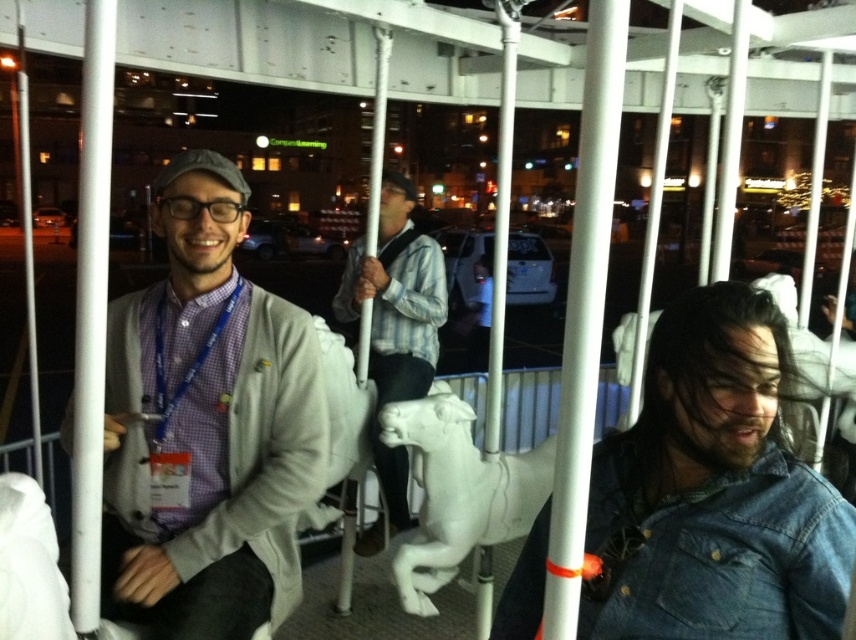
Question: Which object is farther from the camera taking this photo?

Choices:
 (A) matte gray sweater at center
 (B) faded denim jacket at lower right

Answer: (A)

Question: Can you confirm if faded denim jacket at lower right is bigger than white matte horse at center?

Choices:
 (A) no
 (B) yes

Answer: (A)

Question: Can you confirm if faded denim jacket at lower right is wider than striped cotton shirt at center?

Choices:
 (A) yes
 (B) no

Answer: (B)

Question: Which object is positioned farthest from the faded denim jacket at lower right?

Choices:
 (A) matte gray sweater at center
 (B) white matte horse at center

Answer: (B)

Question: Which object is the farthest from the faded denim jacket at lower right?

Choices:
 (A) white matte horse at center
 (B) matte gray sweater at center

Answer: (A)

Question: Considering the relative positions of faded denim jacket at lower right and white matte horse at center in the image provided, where is faded denim jacket at lower right located with respect to white matte horse at center?

Choices:
 (A) above
 (B) below

Answer: (A)